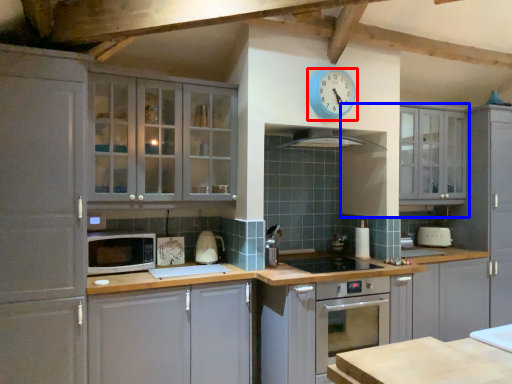
Question: Which point is further to the camera, clock (highlighted by a red box) or cabinetry (highlighted by a blue box)?

Choices:
 (A) clock
 (B) cabinetry

Answer: (B)